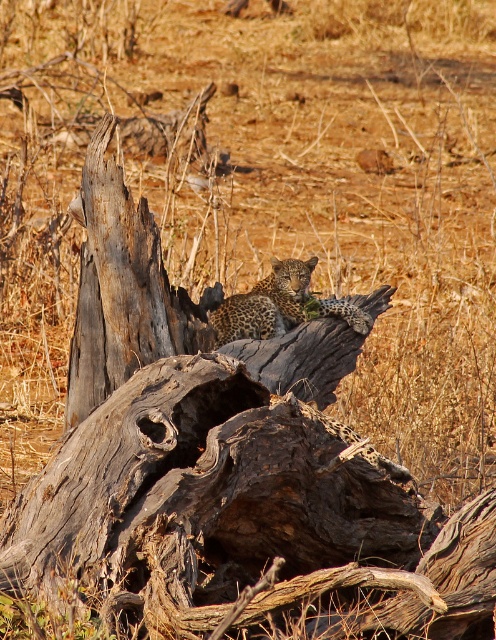
Consider the image. Between brown rough tree trunk at center and spotted fur leopard at center, which one appears on the left side from the viewer's perspective?

Positioned to the left is brown rough tree trunk at center.

Which is in front, point (95, 157) or point (295, 291)?

Positioned in front is point (95, 157).

Locate an element on the screen. Image resolution: width=496 pixels, height=640 pixels. brown rough tree trunk at center is located at coordinates (122, 289).

Where is `brown rough tree trunk at center`? The height and width of the screenshot is (640, 496). brown rough tree trunk at center is located at coordinates (122, 289).